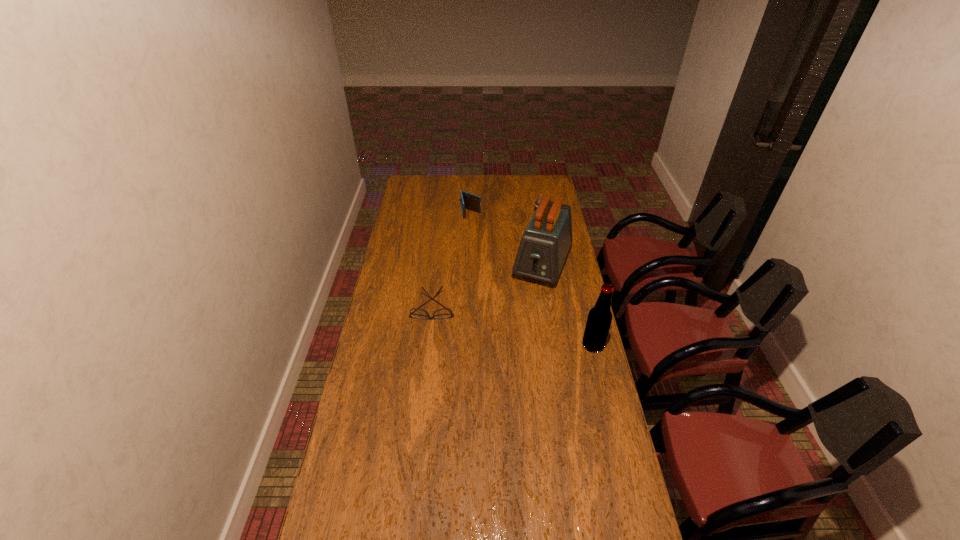
The height and width of the screenshot is (540, 960). Find the location of `vacant spot on the desktop that is between the shortest object and the nearest object and is positioned on the front-facing side of the kitten`. vacant spot on the desktop that is between the shortest object and the nearest object and is positioned on the front-facing side of the kitten is located at coordinates (519, 327).

I want to click on vacant space on the desktop that is between the spectacles and the beer bottle and is positioned on the exterior surface of the wallet, so click(495, 321).

The image size is (960, 540). Find the location of `free space on the desktop that is between the second nearest object and the nearest object and is positioned on the front-facing side of the third farthest object`. free space on the desktop that is between the second nearest object and the nearest object and is positioned on the front-facing side of the third farthest object is located at coordinates (515, 326).